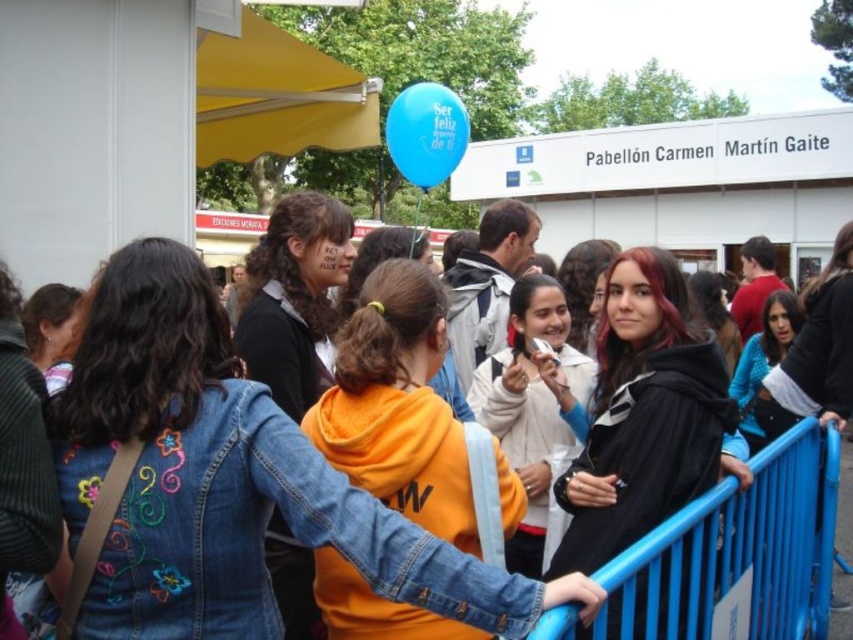
Is white fleece jacket at center to the right of blue denim jacket at lower right from the viewer's perspective?

No, white fleece jacket at center is not to the right of blue denim jacket at lower right.

Who is positioned more to the right, white fleece jacket at center or blue denim jacket at lower right?

blue denim jacket at lower right is more to the right.

Who is more distant from viewer, (543, 396) or (782, 417)?

The point (782, 417) is behind.

Identify the location of white fleece jacket at center. Image resolution: width=853 pixels, height=640 pixels. (532, 412).

Is denim jacket at center wider than black matte jacket at center?

Correct, the width of denim jacket at center exceeds that of black matte jacket at center.

Who is lower down, denim jacket at center or black matte jacket at center?

denim jacket at center

Is point (196, 408) less distant than point (663, 509)?

Yes, point (196, 408) is in front of point (663, 509).

The image size is (853, 640). What are the coordinates of `denim jacket at center` in the screenshot? It's located at (221, 481).

Is point (819, 520) less distant than point (402, 141)?

Yes.

Between point (819, 515) and point (390, 131), which one is positioned behind?

Point (390, 131)

Find the location of `blue plastic fence at center`. blue plastic fence at center is located at coordinates (735, 554).